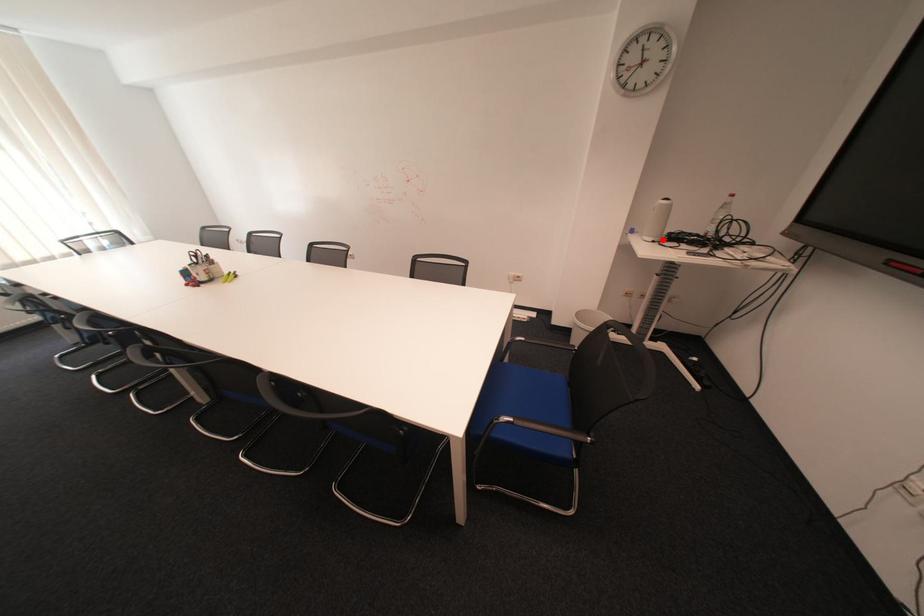
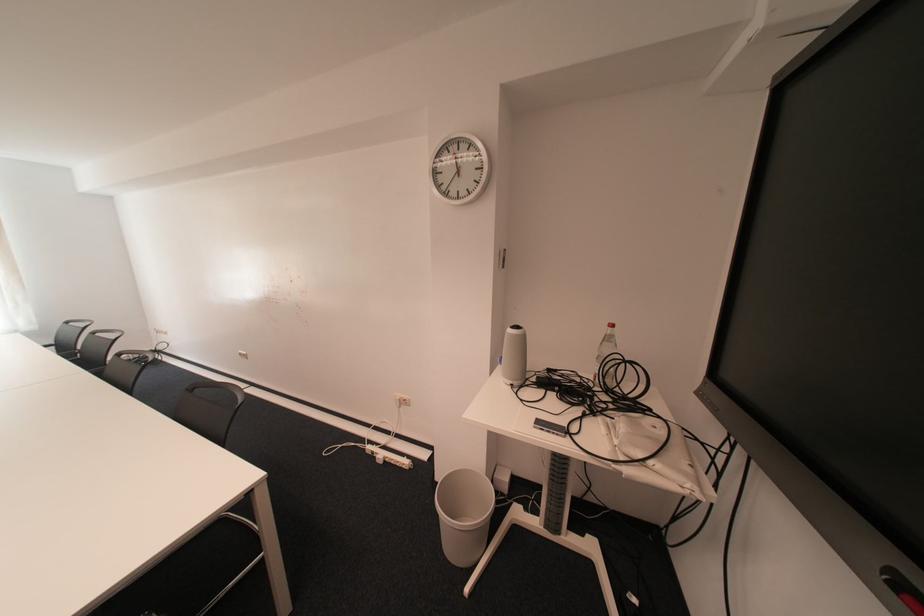
Find the pixel in the second image that matches the highlighted location in the first image.

(520, 383)